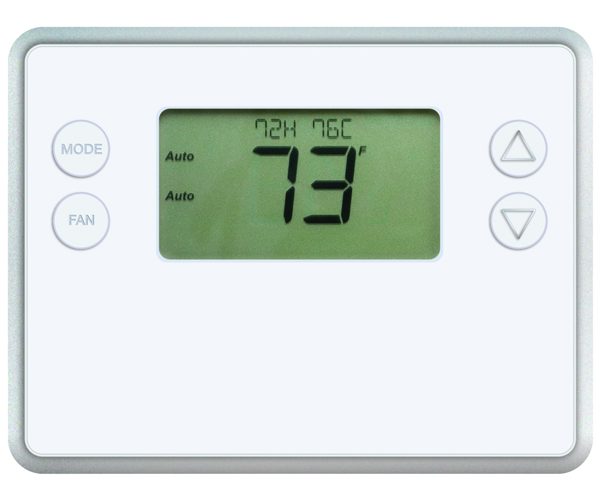
The image size is (600, 500). I want to click on lcd display, so click(x=409, y=189).